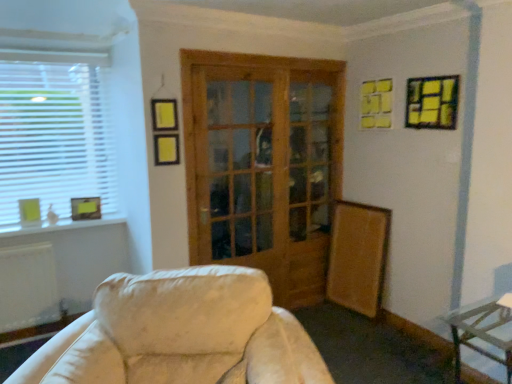
Question: Considering the relative positions of matte yellow picture frame at left, the first picture frame from the left, and wooden glass door at center in the image provided, is matte yellow picture frame at left, the first picture frame from the left, to the left of wooden glass door at center from the viewer's perspective?

Choices:
 (A) yes
 (B) no

Answer: (A)

Question: From a real-world perspective, is matte yellow picture frame at left, the first picture frame from the left, beneath wooden glass door at center?

Choices:
 (A) no
 (B) yes

Answer: (B)

Question: Is matte yellow picture frame at left, acting as the third picture frame starting from the top, shorter than wooden glass door at center?

Choices:
 (A) yes
 (B) no

Answer: (A)

Question: Is matte yellow picture frame at left, the first picture frame from the left, oriented towards wooden glass door at center?

Choices:
 (A) no
 (B) yes

Answer: (A)

Question: Can you confirm if matte yellow picture frame at left, acting as the third picture frame starting from the top, is bigger than wooden glass door at center?

Choices:
 (A) yes
 (B) no

Answer: (B)

Question: Is matte yellow picture frame at left, the third picture frame from the right, surrounding wooden glass door at center?

Choices:
 (A) no
 (B) yes

Answer: (A)

Question: From a real-world perspective, is metallic silver table at lower right on top of matte yellow picture frame at left, which is counted as the second picture frame, starting from the front?

Choices:
 (A) no
 (B) yes

Answer: (A)

Question: Is metallic silver table at lower right turned away from matte yellow picture frame at left, the third picture frame from the right?

Choices:
 (A) no
 (B) yes

Answer: (A)

Question: From the image's perspective, is metallic silver table at lower right located above matte yellow picture frame at left, acting as the third picture frame starting from the top?

Choices:
 (A) yes
 (B) no

Answer: (B)

Question: Is metallic silver table at lower right outside of matte yellow picture frame at left, the first picture frame when ordered from bottom to top?

Choices:
 (A) no
 (B) yes

Answer: (B)

Question: Is metallic silver table at lower right closer to the viewer compared to matte yellow picture frame at left, the first picture frame when ordered from bottom to top?

Choices:
 (A) no
 (B) yes

Answer: (B)

Question: Does metallic silver table at lower right have a greater height compared to matte yellow picture frame at left, the third picture frame from the right?

Choices:
 (A) no
 (B) yes

Answer: (B)

Question: Is yellow paper picture frame at upper right, which appears as the 3th picture frame when viewed from the left, looking in the opposite direction of white plastic window at left?

Choices:
 (A) no
 (B) yes

Answer: (A)